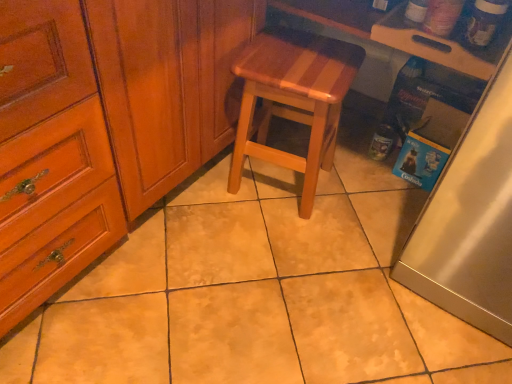
Identify the location of blank area beneath wooden cutting board at upper right (from a real-world perspective). (345, 161).